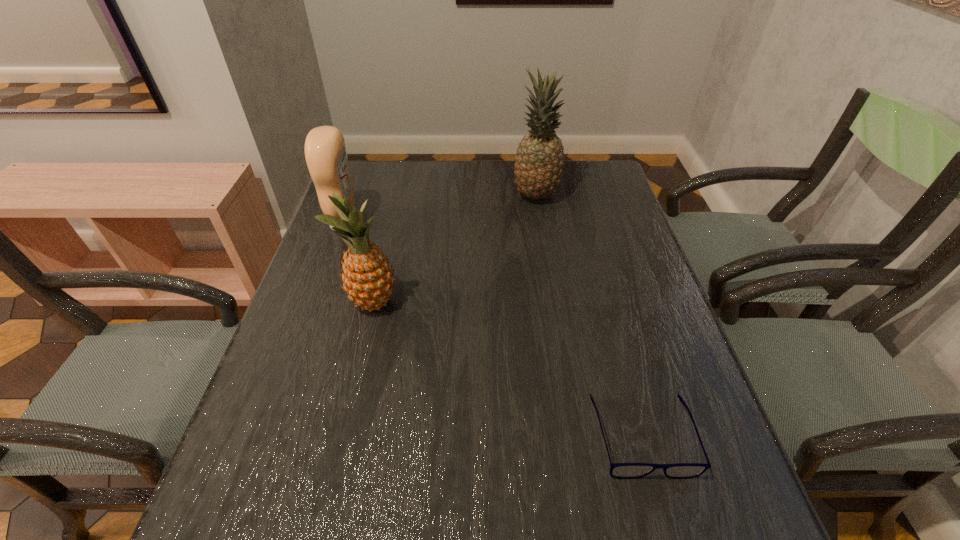
This screenshot has height=540, width=960. I want to click on vacant region located 0.080m on the front-facing side of the shortest object, so click(670, 531).

I want to click on object that is at the far edge, so click(x=539, y=163).

The image size is (960, 540). I want to click on pineapple present at the left edge, so click(x=368, y=279).

The height and width of the screenshot is (540, 960). Find the location of `condiment that is at the left edge`. condiment that is at the left edge is located at coordinates (325, 151).

Identify the location of object at the right edge. (617, 470).

The width and height of the screenshot is (960, 540). What are the coordinates of `free space at the far edge` in the screenshot? It's located at (468, 188).

Identify the location of vacant area at the left edge of the desktop. (276, 408).

In the image, there is a desktop. Where is `vacant space at the right edge`? vacant space at the right edge is located at coordinates (670, 343).

Where is `vacant space at the near right corner`? vacant space at the near right corner is located at coordinates (725, 528).

Locate an element on the screen. free space between the spectacles and the right pineapple is located at coordinates (589, 316).